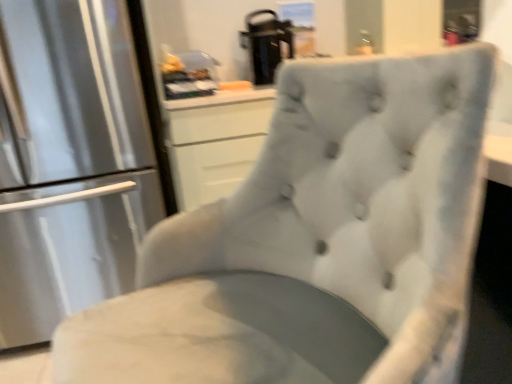
Question: Can you confirm if black plastic coffee maker at upper center is taller than satin silver refrigerator at left?

Choices:
 (A) yes
 (B) no

Answer: (B)

Question: From a real-world perspective, is black plastic coffee maker at upper center physically below satin silver refrigerator at left?

Choices:
 (A) yes
 (B) no

Answer: (B)

Question: Considering the relative positions of black plastic coffee maker at upper center and satin silver refrigerator at left in the image provided, is black plastic coffee maker at upper center to the left of satin silver refrigerator at left from the viewer's perspective?

Choices:
 (A) no
 (B) yes

Answer: (A)

Question: Is black plastic coffee maker at upper center at the right side of satin silver refrigerator at left?

Choices:
 (A) yes
 (B) no

Answer: (A)

Question: Does black plastic coffee maker at upper center have a lesser width compared to satin silver refrigerator at left?

Choices:
 (A) no
 (B) yes

Answer: (B)

Question: From the image's perspective, does black plastic coffee maker at upper center appear lower than satin silver refrigerator at left?

Choices:
 (A) no
 (B) yes

Answer: (A)

Question: Is satin silver refrigerator at left thinner than black plastic coffee maker at upper center?

Choices:
 (A) yes
 (B) no

Answer: (B)

Question: Does satin silver refrigerator at left turn towards black plastic coffee maker at upper center?

Choices:
 (A) yes
 (B) no

Answer: (B)

Question: Considering the relative sizes of satin silver refrigerator at left and black plastic coffee maker at upper center in the image provided, is satin silver refrigerator at left smaller than black plastic coffee maker at upper center?

Choices:
 (A) no
 (B) yes

Answer: (A)

Question: From a real-world perspective, is satin silver refrigerator at left on black plastic coffee maker at upper center?

Choices:
 (A) no
 (B) yes

Answer: (A)

Question: Would you say black plastic coffee maker at upper center is part of satin silver refrigerator at left's contents?

Choices:
 (A) no
 (B) yes

Answer: (A)

Question: Does satin silver refrigerator at left have a lesser height compared to black plastic coffee maker at upper center?

Choices:
 (A) no
 (B) yes

Answer: (A)

Question: From the image's perspective, is black plastic coffee maker at upper center above or below satin silver refrigerator at left?

Choices:
 (A) below
 (B) above

Answer: (B)